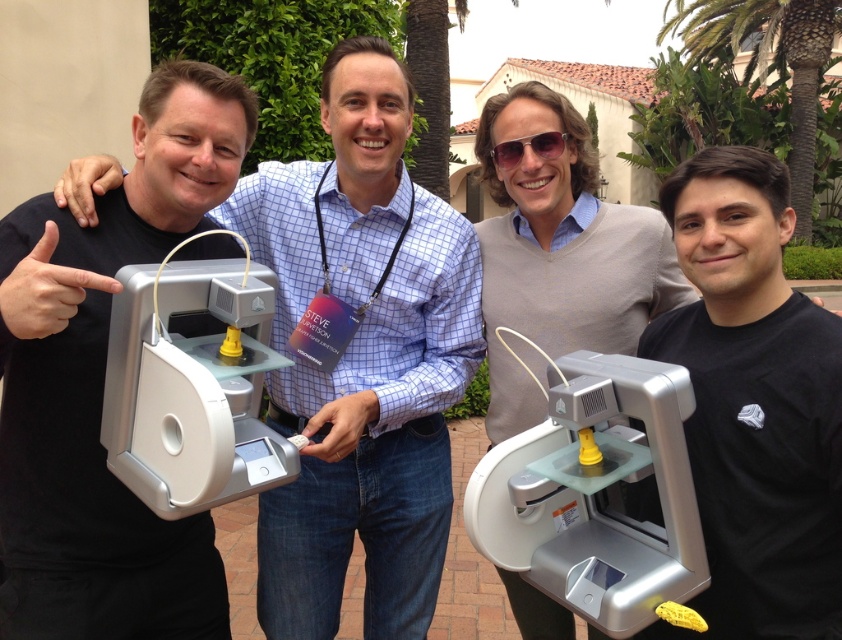
This screenshot has width=842, height=640. What do you see at coordinates (361, 358) in the screenshot?
I see `matte silver printer at center` at bounding box center [361, 358].

Based on the photo, can you confirm if matte silver printer at center is positioned to the left of silver metallic 3d printer at left?

Incorrect, matte silver printer at center is not on the left side of silver metallic 3d printer at left.

Does point (289, 332) come farther from viewer compared to point (264, 284)?

Yes, it is.

Locate an element on the screen. The width and height of the screenshot is (842, 640). matte silver printer at center is located at coordinates (361, 358).

Does matte silver printer at center have a larger size compared to green leafy palm tree at upper right?

Yes.

Can you confirm if matte silver printer at center is positioned below green leafy palm tree at upper right?

Indeed, matte silver printer at center is positioned under green leafy palm tree at upper right.

Is point (440, 301) farther from camera compared to point (809, 184)?

No, it is not.

Identify the location of matte silver printer at center. (361, 358).

Which is behind, point (115, 211) or point (624, 570)?

Point (115, 211)

Who is positioned more to the right, matte black printer at left or silver metallic 3d printer at center?

Positioned to the right is silver metallic 3d printer at center.

Image resolution: width=842 pixels, height=640 pixels. What do you see at coordinates (102, 384) in the screenshot?
I see `matte black printer at left` at bounding box center [102, 384].

Where is `matte black printer at left`? This screenshot has width=842, height=640. matte black printer at left is located at coordinates (102, 384).